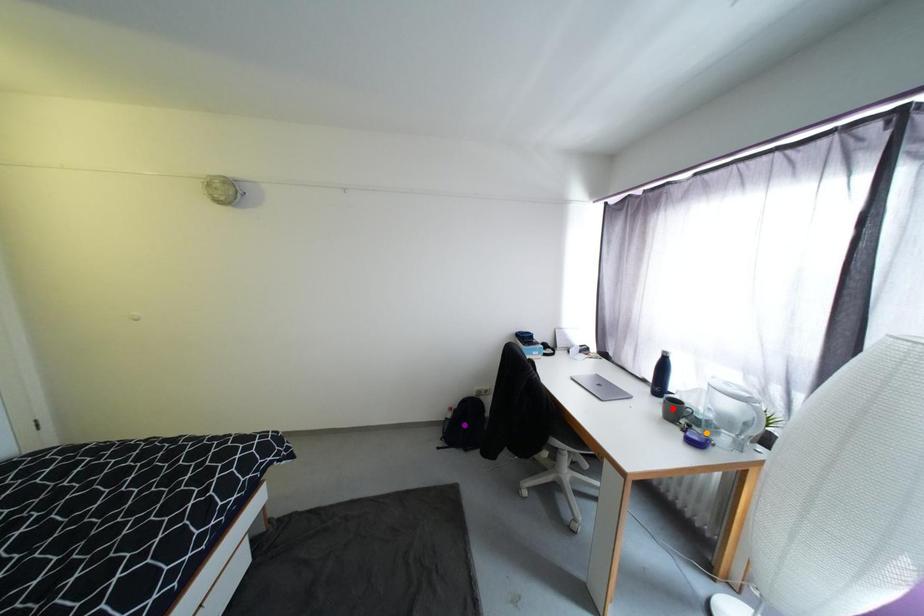
Order these from farthest to nearest:
- orange point
- red point
- purple point

purple point < red point < orange point